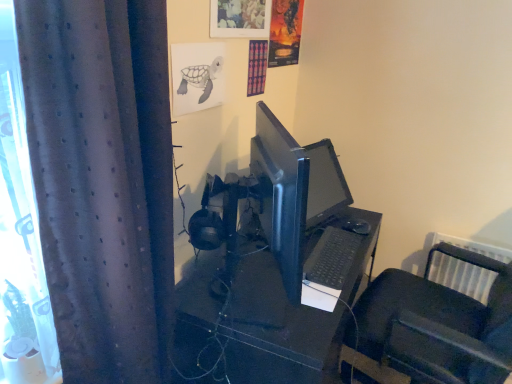
Question: Is black matte keyboard at center closer to camera compared to black plastic desk at center?

Choices:
 (A) no
 (B) yes

Answer: (A)

Question: Does black matte keyboard at center have a greater width compared to black plastic desk at center?

Choices:
 (A) yes
 (B) no

Answer: (B)

Question: From a real-world perspective, is black matte keyboard at center located beneath black plastic desk at center?

Choices:
 (A) yes
 (B) no

Answer: (B)

Question: Is black matte keyboard at center turned away from black plastic desk at center?

Choices:
 (A) no
 (B) yes

Answer: (A)

Question: Could you tell me if black matte keyboard at center is facing black plastic desk at center?

Choices:
 (A) yes
 (B) no

Answer: (B)

Question: Considering the relative positions of black plastic chair at lower right and black matte keyboard at center in the image provided, is black plastic chair at lower right to the left or to the right of black matte keyboard at center?

Choices:
 (A) right
 (B) left

Answer: (A)

Question: Is black plastic chair at lower right situated inside black matte keyboard at center or outside?

Choices:
 (A) inside
 (B) outside

Answer: (B)

Question: In the image, is black plastic chair at lower right positioned in front of or behind black matte keyboard at center?

Choices:
 (A) behind
 (B) front

Answer: (A)

Question: From a real-world perspective, relative to black matte keyboard at center, is black plastic chair at lower right vertically above or below?

Choices:
 (A) above
 (B) below

Answer: (B)

Question: Visually, is black plastic desk at center positioned to the left or to the right of dark grey textured curtain at left?

Choices:
 (A) left
 (B) right

Answer: (B)

Question: From a real-world perspective, is black plastic desk at center physically located above or below dark grey textured curtain at left?

Choices:
 (A) above
 (B) below

Answer: (B)

Question: In terms of height, does black plastic desk at center look taller or shorter compared to dark grey textured curtain at left?

Choices:
 (A) short
 (B) tall

Answer: (A)

Question: Relative to dark grey textured curtain at left, is black plastic desk at center in front or behind?

Choices:
 (A) front
 (B) behind

Answer: (B)

Question: From a real-world perspective, is black matte keyboard at center positioned above or below dark grey textured curtain at left?

Choices:
 (A) above
 (B) below

Answer: (B)

Question: Is black matte keyboard at center taller or shorter than dark grey textured curtain at left?

Choices:
 (A) short
 (B) tall

Answer: (A)